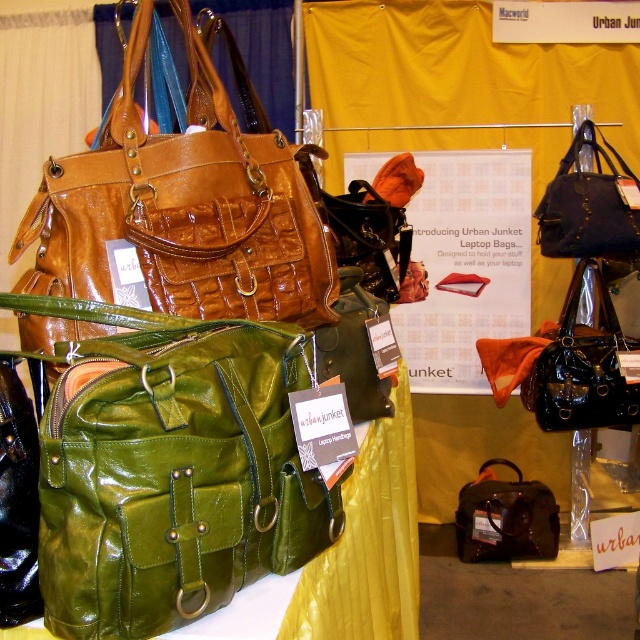
Does point (323, 515) lie in front of point (605, 234)?

Yes, point (323, 515) is closer to viewer.

Is green leather bag at center thinner than matte black bag at upper right?

Yes.

Between point (138, 488) and point (572, 252), which one is positioned in front?

Point (138, 488) is in front.

This screenshot has width=640, height=640. In order to click on green leather bag at center in this screenshot , I will do `click(173, 476)`.

Does green leather bag at center appear on the right side of green leather bag at left?

Yes, green leather bag at center is to the right of green leather bag at left.

Between point (243, 403) and point (109, 216), which one is positioned behind?

The point (109, 216) is more distant.

Measure the distance between green leather bag at center and camera.

24.04 inches

This screenshot has height=640, width=640. What are the coordinates of `green leather bag at center` in the screenshot? It's located at (173, 476).

Is point (458, 150) closer to camera compared to point (513, 465)?

Yes, point (458, 150) is in front of point (513, 465).

The height and width of the screenshot is (640, 640). I want to click on matte white paper at center, so click(x=467, y=264).

Identify the location of matte white paper at center. (467, 264).